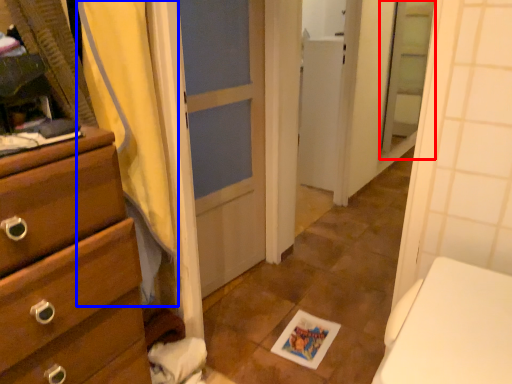
Question: Among these objects, which one is nearest to the camera, screen door (highlighted by a red box) or shower curtain (highlighted by a blue box)?

Choices:
 (A) screen door
 (B) shower curtain

Answer: (B)